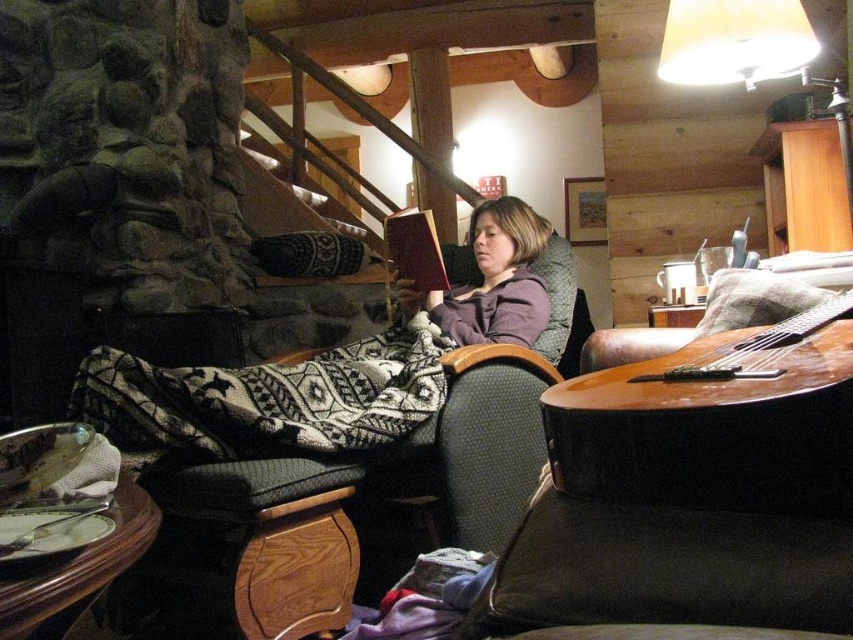
You are standing in the living room and want to place a small plant between the two points, point [299,396] and point [260,616]. Which point should the plant be closer to so it is nearer to the viewer?

The plant should be placed closer to point [299,396] because it is closer to the viewer than point [260,616].